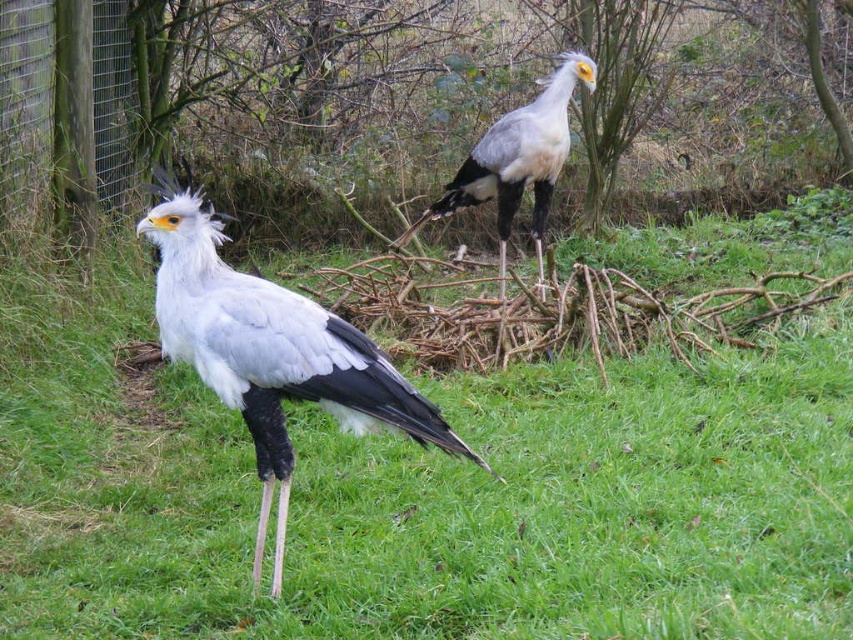
You are a visitor at the zoo observing the two secretary birds in their enclosure. You notice the green grass at center and the white matte bird at center. Which object is taller in this scene?

The white matte bird at center is taller than the green grass at center.